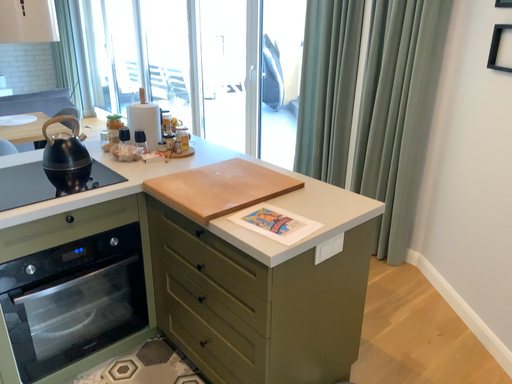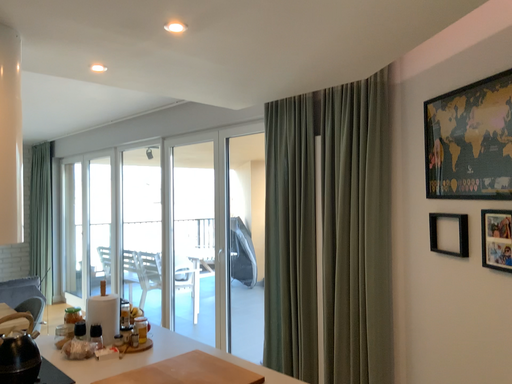
Question: How did the camera likely rotate when shooting the video?

Choices:
 (A) rotated upward
 (B) rotated downward

Answer: (A)